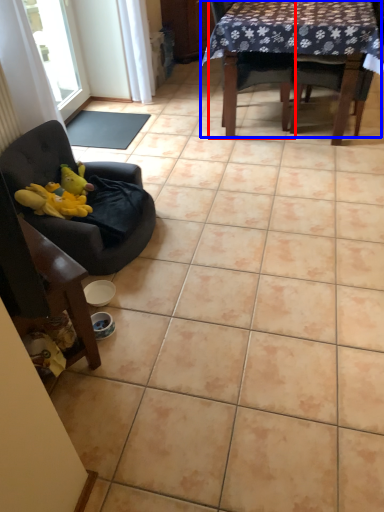
Question: Which object appears closest to the camera in this image, chair (highlighted by a red box) or table (highlighted by a blue box)?

Choices:
 (A) chair
 (B) table

Answer: (B)